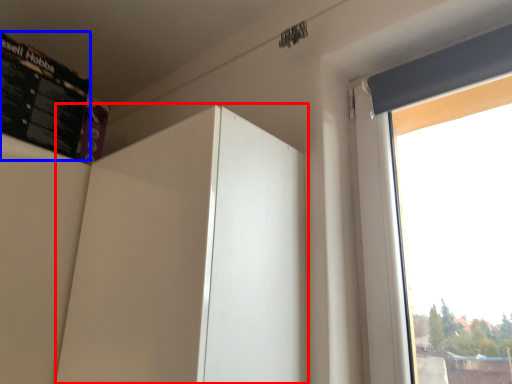
Question: Which point is further to the camera, screen door (highlighted by a red box) or bulletin board (highlighted by a blue box)?

Choices:
 (A) screen door
 (B) bulletin board

Answer: (B)